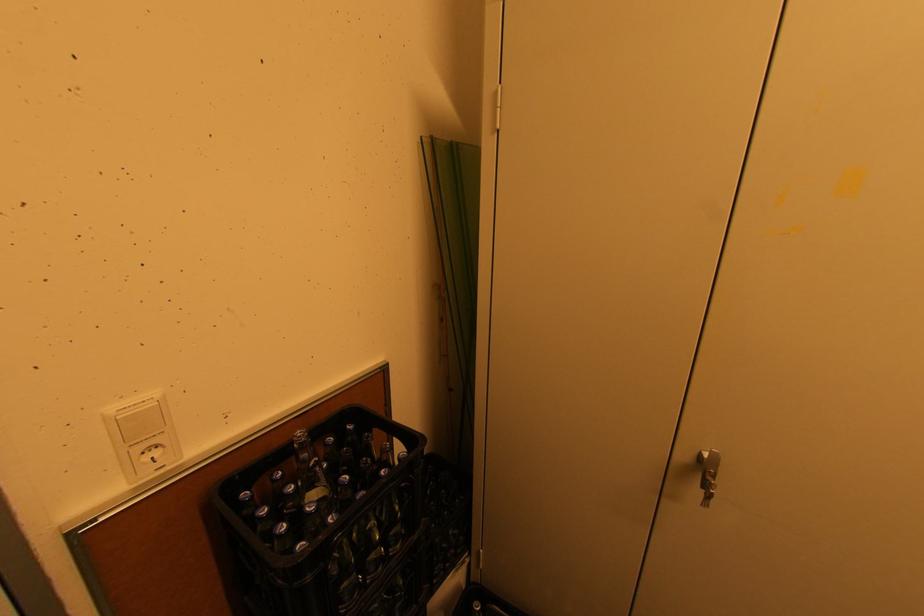
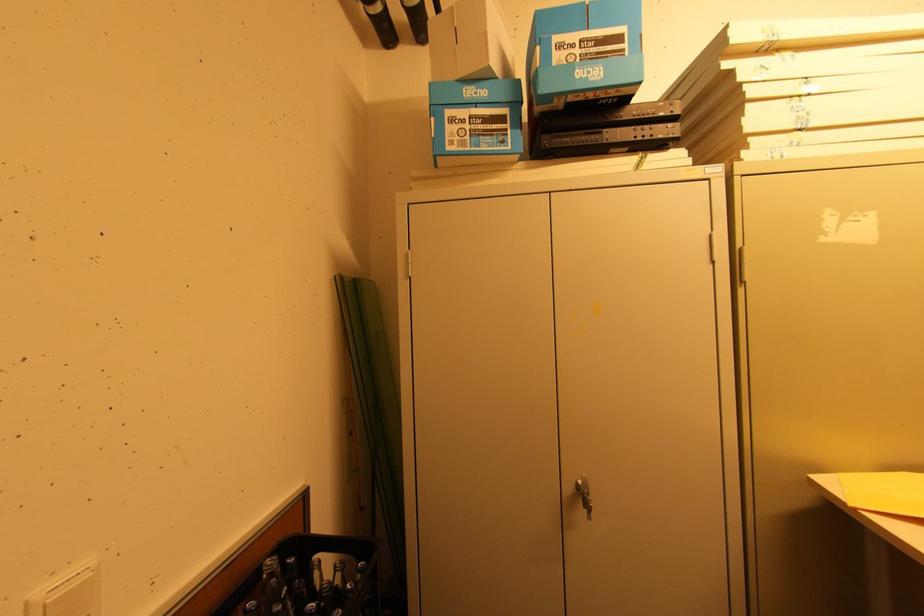
In the second image, find the point that corresponds to the point at 355,424 in the first image.

(294, 557)